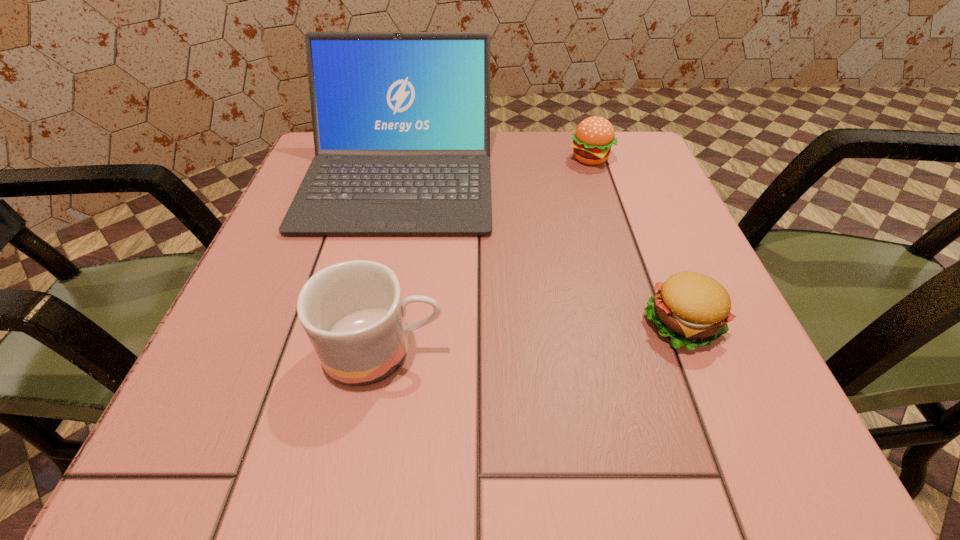
This screenshot has width=960, height=540. I want to click on the closest object relative to the laptop computer, so click(594, 136).

At what (x,y) coordinates should I click in order to perform the action: click on object that ranks as the closest to the mug. Please return your answer as a coordinate pair (x, y). The image size is (960, 540). Looking at the image, I should click on pyautogui.click(x=401, y=120).

The image size is (960, 540). Identify the location of vacant area that satisfies the following two spatial constraints: 1. on the screen of the laptop computer; 2. on the left side of the nearer hamburger. (366, 323).

Locate an element on the screen. free space that satisfies the following two spatial constraints: 1. on the front side of the farther hamburger; 2. on the side with the handle of the third shortest object is located at coordinates (652, 350).

Image resolution: width=960 pixels, height=540 pixels. In order to click on free point that satisfies the following two spatial constraints: 1. on the screen of the nearer hamburger; 2. on the right side of the laptop computer in this screenshot , I will do `click(366, 323)`.